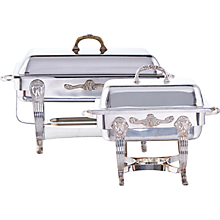
This screenshot has width=220, height=220. Find the location of `ornamental decoration`. ornamental decoration is located at coordinates (150, 123).